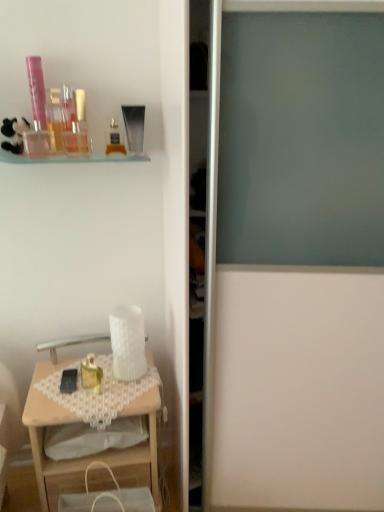
Identify the location of free space to the back side of gold metallic perfume at lower left, which is the 8th toiletry in top-to-bottom order. The width and height of the screenshot is (384, 512). (95, 367).